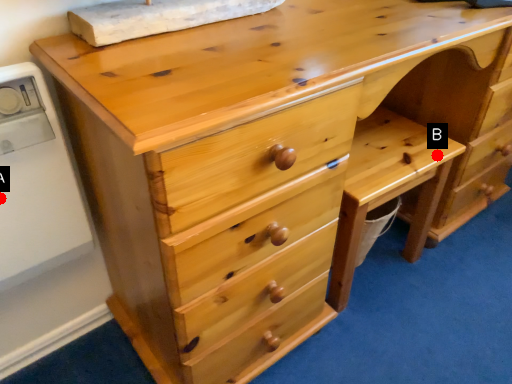
Question: Two points are circled on the image, labeled by A and B beside each circle. Which point is farther from the camera taking this photo?

Choices:
 (A) A is further
 (B) B is further

Answer: (B)